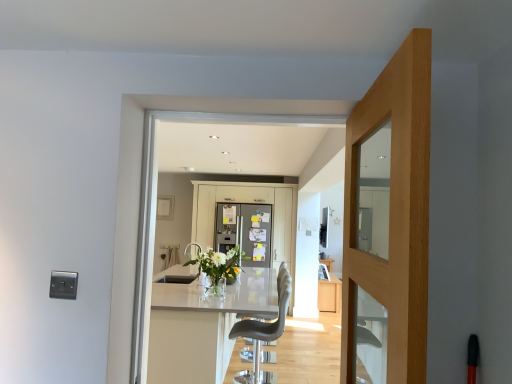
This screenshot has height=384, width=512. Describe the element at coordinates (395, 210) in the screenshot. I see `light oak door at center` at that location.

Find the location of `white glossy table at center`. white glossy table at center is located at coordinates (202, 326).

Where is `matte white cabinet at center`? matte white cabinet at center is located at coordinates (330, 294).

At what (x,y) coordinates should I click in order to perform the action: click on matte gray bar stool at center. Please return your answer as a coordinate pair (x, y). This screenshot has height=384, width=512. Looking at the image, I should click on (262, 336).

Where is `clear glass vase at center`? The height and width of the screenshot is (384, 512). clear glass vase at center is located at coordinates (219, 263).

The height and width of the screenshot is (384, 512). Describe the element at coordinates (248, 202) in the screenshot. I see `satin white refrigerator at center` at that location.

Where is `light oak door at center`? light oak door at center is located at coordinates (395, 210).

Consider the image. Is the surface of satin silver refrigerator at center in direct contact with light oak door at center?

No, satin silver refrigerator at center is not beside light oak door at center.

Is light oak door at center surrounded by satin silver refrigerator at center?

No, light oak door at center is not surrounded by satin silver refrigerator at center.

Between satin silver refrigerator at center and light oak door at center, which one has smaller width?

light oak door at center.

Measure the distance between satin silver refrigerator at center and light oak door at center.

satin silver refrigerator at center and light oak door at center are 4.51 meters apart.

Considering the positions of point (253, 346) and point (329, 305), is point (253, 346) closer or farther from the camera than point (329, 305)?

Point (253, 346).

Is matte gray bar stool at center not near matte white cabinet at center?

Yes, matte gray bar stool at center is far from matte white cabinet at center.

Which of these two, matte gray bar stool at center or matte white cabinet at center, stands shorter?

matte white cabinet at center.

Does matte gray bar stool at center come in front of matte white cabinet at center?

Yes, matte gray bar stool at center is in front of matte white cabinet at center.

Is satin white refrigerator at center oriented towards white glossy table at center?

Yes, satin white refrigerator at center is turned towards white glossy table at center.

From their relative heights in the image, would you say satin white refrigerator at center is taller or shorter than white glossy table at center?

Clearly, satin white refrigerator at center is taller compared to white glossy table at center.

From the image's perspective, does satin white refrigerator at center appear lower than white glossy table at center?

No, from the image's perspective, satin white refrigerator at center is not below white glossy table at center.

Considering the relative sizes of satin white refrigerator at center and white glossy table at center in the image provided, is satin white refrigerator at center wider than white glossy table at center?

Incorrect, the width of satin white refrigerator at center does not surpass that of white glossy table at center.

Find the location of a particular element. The image size is (512, 384). kitchen & dining room table below the matte gray bar stool at center (from a real-world perspective) is located at coordinates (202, 326).

Is point (237, 336) behind point (208, 345)?

Yes, it is.

Looking at this image, from the image's perspective, which is above, matte gray bar stool at center or white glossy table at center?

matte gray bar stool at center is shown above in the image.

Considering the sizes of objects matte gray bar stool at center and white glossy table at center in the image provided, who is bigger, matte gray bar stool at center or white glossy table at center?

With larger size is white glossy table at center.

From a real-world perspective, is matte white cabinet at center beneath light oak door at center?

Yes.

Is matte white cabinet at center looking in the opposite direction of light oak door at center?

That's not correct — matte white cabinet at center is not looking away from light oak door at center.

Considering the sizes of objects matte white cabinet at center and light oak door at center in the image provided, who is wider, matte white cabinet at center or light oak door at center?

Wider between the two is matte white cabinet at center.

Does point (326, 296) lie behind point (264, 299)?

Yes, point (326, 296) is farther from viewer.

Looking at this image, from the image's perspective, is matte white cabinet at center located beneath white glossy table at center?

Indeed, from the image's perspective, matte white cabinet at center is shown beneath white glossy table at center.

Identify the location of cabinetry directly beneath the white glossy table at center (from a real-world perspective). (330, 294).

Which of these two, white glossy table at center or satin silver refrigerator at center, is thinner?

Thinner between the two is satin silver refrigerator at center.

Is white glossy table at center placed right next to satin silver refrigerator at center?

white glossy table at center and satin silver refrigerator at center are not in contact.

Which object is positioned more to the left, white glossy table at center or satin silver refrigerator at center?

white glossy table at center is more to the left.

The width and height of the screenshot is (512, 384). Identify the location of refrigerator behind the light oak door at center. (245, 231).

Locate an element on the screen. The height and width of the screenshot is (384, 512). chair on the left of matte white cabinet at center is located at coordinates [262, 336].

When comparing their distances from white glossy table at center, does satin white refrigerator at center or light oak door at center seem further?

Based on the image, light oak door at center appears to be further to white glossy table at center.

Consider the image. When comparing their distances from satin silver refrigerator at center, does light oak door at center or matte gray bar stool at center seem closer?

Based on the image, matte gray bar stool at center appears to be nearer to satin silver refrigerator at center.

Estimate the real-world distances between objects in this image. Which object is further from matte white cabinet at center, matte gray bar stool at center or light oak door at center?

light oak door at center lies further to matte white cabinet at center than the other object.

Looking at the image, which one is located further to light oak door at center, matte gray bar stool at center or satin silver refrigerator at center?

satin silver refrigerator at center is further to light oak door at center.

When comparing their distances from satin white refrigerator at center, does light oak door at center or matte gray bar stool at center seem closer?

Among the two, matte gray bar stool at center is located nearer to satin white refrigerator at center.

Based on their spatial positions, is white glossy table at center or matte white cabinet at center further from matte gray bar stool at center?

matte white cabinet at center is further to matte gray bar stool at center.

Estimate the real-world distances between objects in this image. Which object is closer to satin white refrigerator at center, white glossy table at center or matte gray bar stool at center?

white glossy table at center is positioned closer to the anchor satin white refrigerator at center.

Looking at the image, which one is located further to light oak door at center, satin white refrigerator at center or matte white cabinet at center?

Based on the image, satin white refrigerator at center appears to be further to light oak door at center.

The height and width of the screenshot is (384, 512). I want to click on chair positioned between white glossy table at center and satin silver refrigerator at center from near to far, so click(x=262, y=336).

Locate an element on the screen. This screenshot has height=384, width=512. refrigerator between light oak door at center and matte white cabinet at center along the z-axis is located at coordinates (245, 231).

Locate an element on the screen. The image size is (512, 384). chair between light oak door at center and satin white refrigerator at center along the z-axis is located at coordinates (262, 336).

You are a GUI agent. You are given a task and a screenshot of the screen. Output one action in this format:
    pyautogui.click(x=<x>, y=<y>)
    Task: Click on the kitchen & dining room table located between light oak door at center and clear glass vase at center in the depth direction
    Image resolution: width=512 pixels, height=384 pixels.
    Given the screenshot: What is the action you would take?
    pyautogui.click(x=202, y=326)